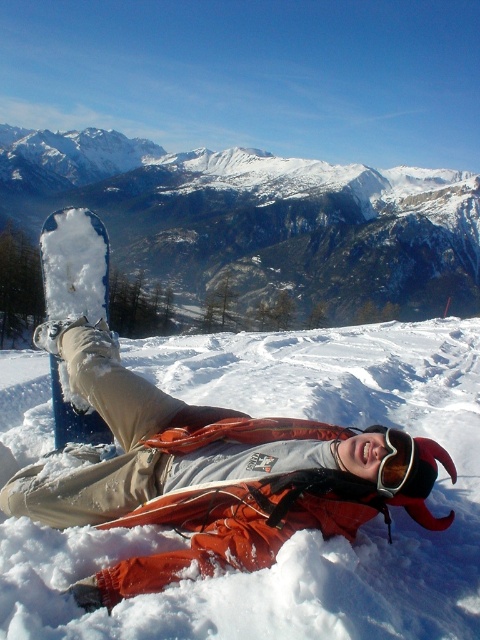
Can you confirm if white snowboard at upper left is smaller than transparent plastic goggles at upper center?

Incorrect, white snowboard at upper left is not smaller in size than transparent plastic goggles at upper center.

Based on the photo, which is more to the left, white snowboard at upper left or transparent plastic goggles at upper center?

From the viewer's perspective, white snowboard at upper left appears more on the left side.

Between point (191, 250) and point (386, 492), which one is positioned behind?

The point (191, 250) is more distant.

This screenshot has height=640, width=480. I want to click on white snowboard at upper left, so click(x=260, y=220).

Is the position of white fluffy snow at lower center less distant than that of transparent plastic goggles at upper center?

Yes, white fluffy snow at lower center is in front of transparent plastic goggles at upper center.

Who is lower down, white fluffy snow at lower center or transparent plastic goggles at upper center?

transparent plastic goggles at upper center is below.

Identify the location of white fluffy snow at lower center. (300, 531).

This screenshot has height=640, width=480. What are the coordinates of `white fluffy snow at lower center` in the screenshot? It's located at tap(300, 531).

Who is more forward, (12, 387) or (205, 179)?

Positioned in front is point (12, 387).

Between white fluffy snow at lower center and white snowboard at upper left, which one has more height?

white snowboard at upper left

Who is more forward, (x=316, y=378) or (x=148, y=234)?

Point (x=316, y=378) is more forward.

Find the location of `white fluffy snow at lower center`. white fluffy snow at lower center is located at coordinates (300, 531).